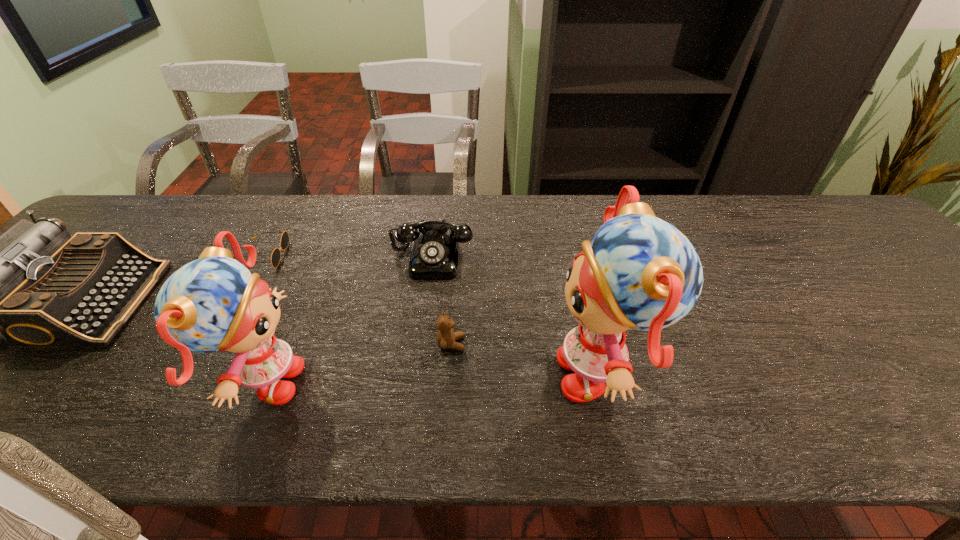
Locate an element on the screen. vacant space located on the face of the rightmost object is located at coordinates (372, 373).

At what (x,y) coordinates should I click in order to perform the action: click on vacant space located 0.060m on the dial of the telephone. Please return your answer as a coordinate pair (x, y). The height and width of the screenshot is (540, 960). Looking at the image, I should click on (427, 297).

This screenshot has height=540, width=960. I want to click on vacant space positioned 0.400m on the front-facing side of the sunglasses, so click(434, 255).

In order to click on vacant region located on the front-facing side of the teddy bear in this screenshot , I will do `click(570, 343)`.

The height and width of the screenshot is (540, 960). What are the coordinates of `telephone that is positioned at the far edge` in the screenshot? It's located at pyautogui.click(x=434, y=256).

Find the location of a particular element. The image size is (960, 540). sunglasses that is at the far edge is located at coordinates (276, 254).

Find the location of a particular element. This screenshot has width=960, height=540. vacant space at the far edge of the desktop is located at coordinates (216, 225).

This screenshot has width=960, height=540. In the image, there is a desktop. Find the location of `vacant area at the near edge`. vacant area at the near edge is located at coordinates (511, 368).

Where is `free space at the right edge of the desktop`? This screenshot has height=540, width=960. free space at the right edge of the desktop is located at coordinates (948, 320).

Locate an element on the screen. The height and width of the screenshot is (540, 960). free space at the far left corner is located at coordinates (141, 239).